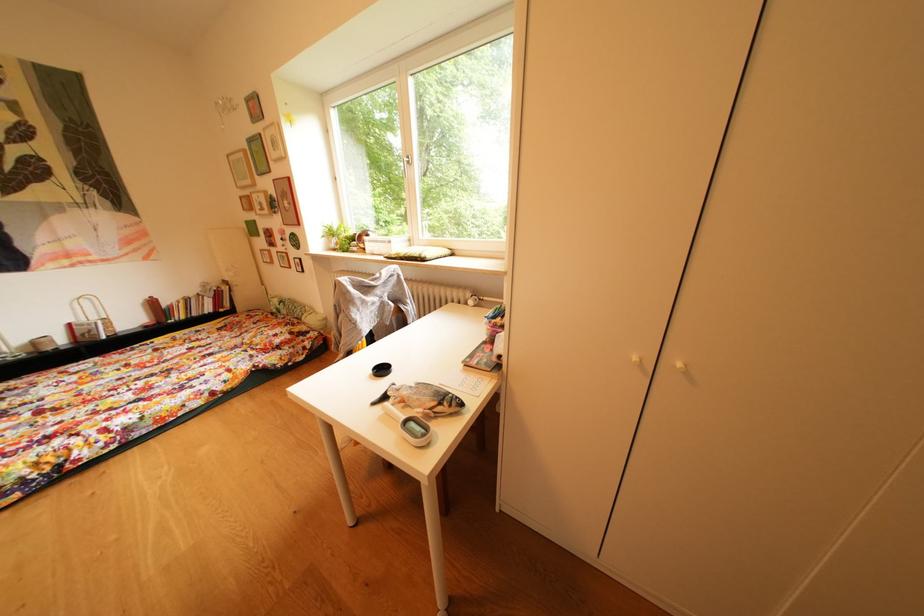
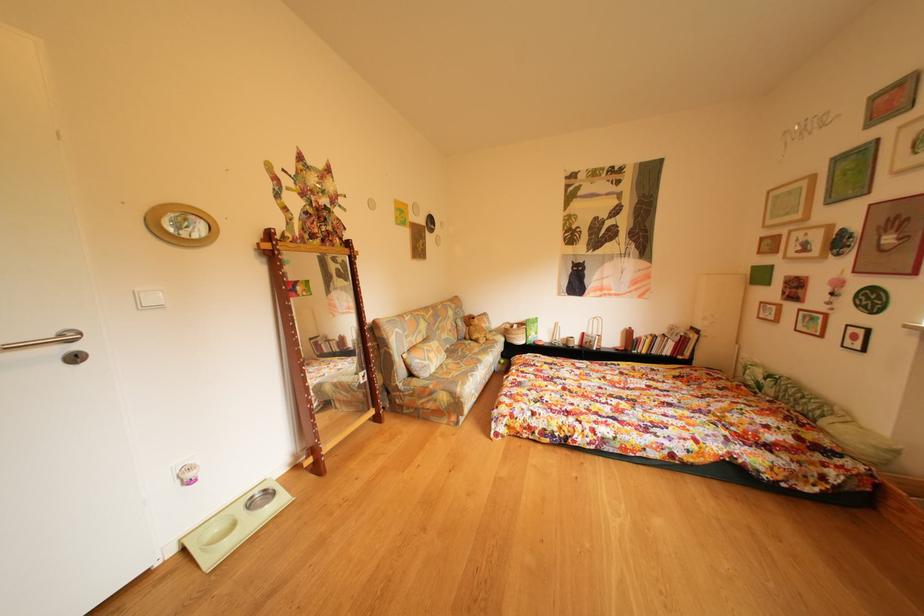
Question: The first image is from the beginning of the video and the second image is from the end. How did the camera likely rotate when shooting the video?

Choices:
 (A) Left
 (B) Right
 (C) Up
 (D) Down

Answer: (A)